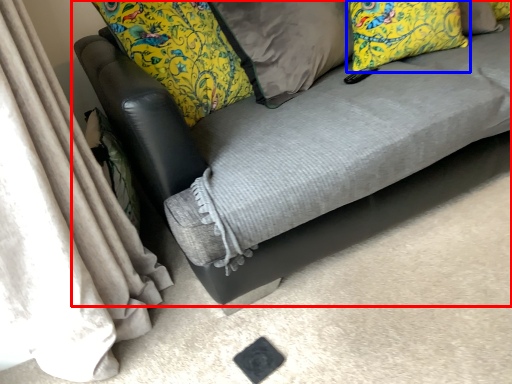
Question: Which object appears farthest to the camera in this image, studio couch (highlighted by a red box) or pillow (highlighted by a blue box)?

Choices:
 (A) studio couch
 (B) pillow

Answer: (B)